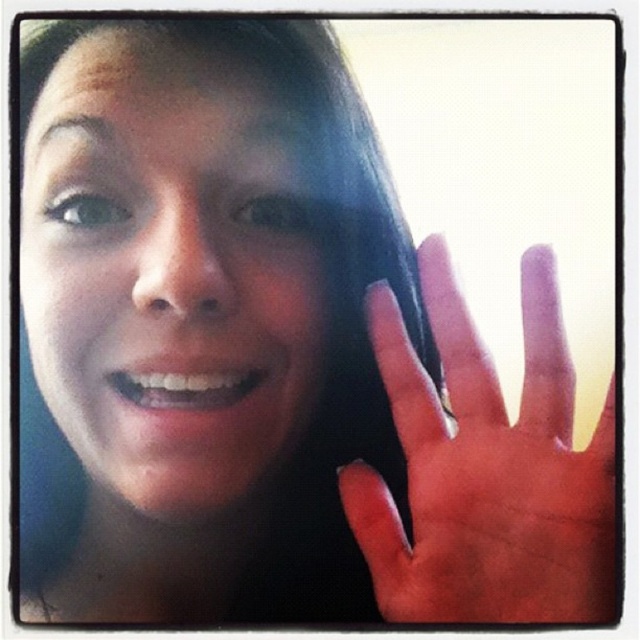
Which is below, smooth skin face at center or dry skin hand at right?

dry skin hand at right is below.

Does smooth skin face at center have a lesser width compared to dry skin hand at right?

In fact, smooth skin face at center might be wider than dry skin hand at right.

Measure the distance between smooth skin face at center and camera.

The distance of smooth skin face at center from camera is 16.97 inches.

The image size is (640, 640). Identify the location of smooth skin face at center. tap(170, 266).